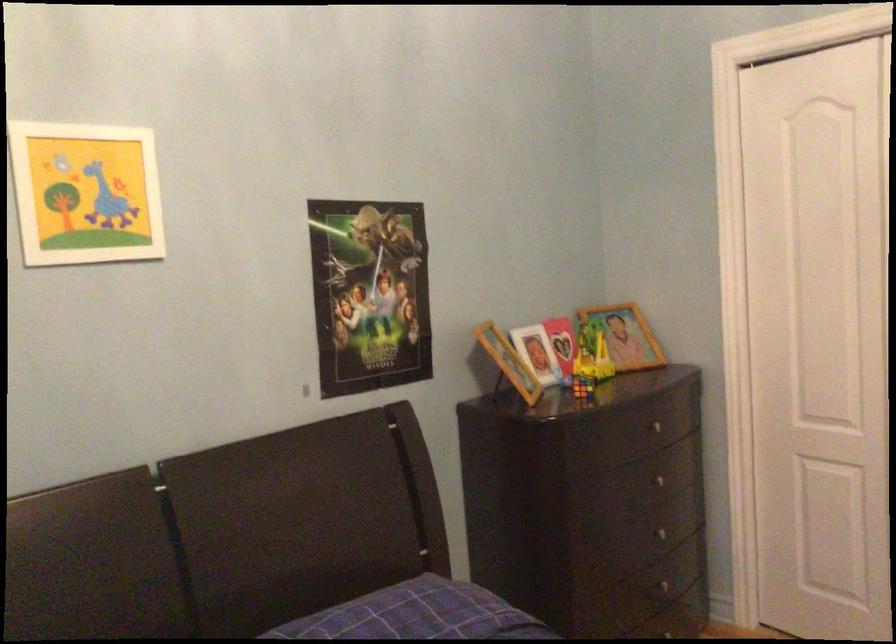
Find where to turn the Rubik's cube. Please return your answer as a coordinate pair (x, y).

(582, 386)